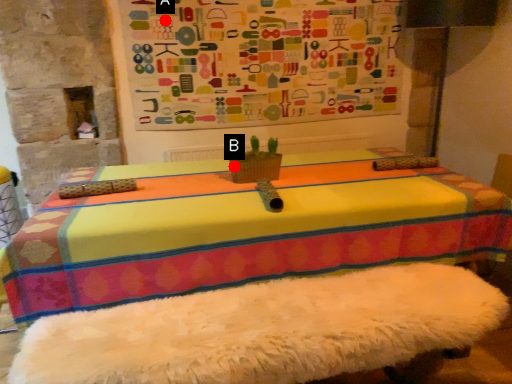
Question: Two points are circled on the image, labeled by A and B beside each circle. Which point is closer to the camera?

Choices:
 (A) A is closer
 (B) B is closer

Answer: (B)